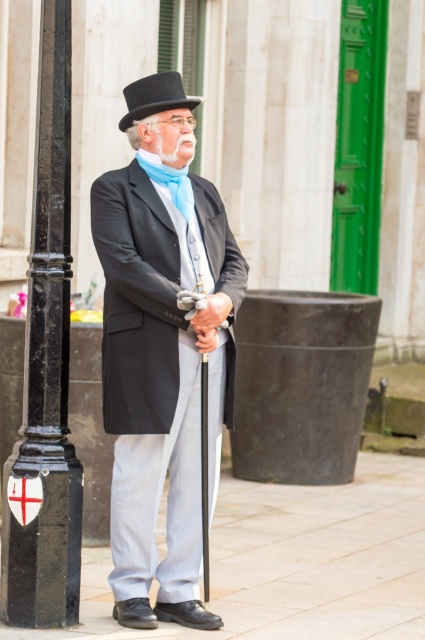
You are a photographer setting up for a formal event. You need to position a camera so that both the black polished metal pole at left and the black felt top hat at upper center are in frame. Based on their positions, which object will appear higher in the photo?

→ The black felt top hat at upper center will appear higher in the photo because it is positioned above the black polished metal pole at left.

You are a security guard standing at point (45, 372). You need to reach the black polished metal pole at left. Is it within your immediate vicinity?

The black polished metal pole at left is located at point (45, 372), so yes, it is within your immediate vicinity.

From the picture: You are a delivery person trying to park your bike. The bike requires 6 feet of space. You see the light gray stone pavement at lower center and the black polished metal pole at left. Is there enough space between them to park your bike?

The light gray stone pavement at lower center is 7.12 feet from the black polished metal pole at left, which is more than the 6 feet needed. Therefore, there is enough space to park the bike between them.